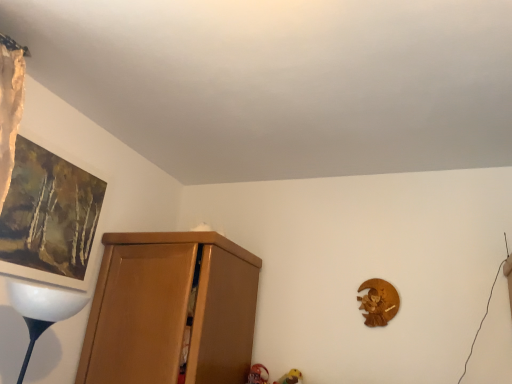
What is the approximate height of matte brown picture frame at upper left?

matte brown picture frame at upper left is 22.93 inches tall.

Describe the element at coordinates (49, 216) in the screenshot. Image resolution: width=512 pixels, height=384 pixels. I see `matte brown picture frame at upper left` at that location.

You are a GUI agent. You are given a task and a screenshot of the screen. Output one action in this format:
    pyautogui.click(x=<x>, y=<y>)
    Task: Click on the matte brown picture frame at upper left
    
    Given the screenshot: What is the action you would take?
    pyautogui.click(x=49, y=216)

This screenshot has height=384, width=512. Find the location of `matte wood cupboard at left`. matte wood cupboard at left is located at coordinates (170, 309).

The image size is (512, 384). What do you see at coordinates (170, 309) in the screenshot?
I see `matte wood cupboard at left` at bounding box center [170, 309].

What is the approximate height of matte wood cupboard at left?

It is 28.36 inches.

Where is `matte brown picture frame at upper left`? matte brown picture frame at upper left is located at coordinates (49, 216).

Based on their positions, is matte wood cupboard at left located to the left or right of matte brown picture frame at upper left?

matte wood cupboard at left is to the right of matte brown picture frame at upper left.

Between matte wood cupboard at left and matte brown picture frame at upper left, which one is positioned in front?

matte brown picture frame at upper left is in front.

Between point (228, 307) and point (29, 232), which one is positioned in front?

The point (29, 232) is closer.

From the image's perspective, which one is positioned lower, matte wood cupboard at left or matte brown picture frame at upper left?

matte wood cupboard at left appears lower in the image.

From a real-world perspective, is matte wood cupboard at left on matte brown picture frame at upper left?

No, from a real-world perspective, matte wood cupboard at left is not above matte brown picture frame at upper left.

Based on the photo, considering the sizes of matte wood cupboard at left and matte brown picture frame at upper left in the image, is matte wood cupboard at left wider or thinner than matte brown picture frame at upper left?

Considering their sizes, matte wood cupboard at left looks broader than matte brown picture frame at upper left.

Considering the sizes of objects matte wood cupboard at left and matte brown picture frame at upper left in the image provided, who is shorter, matte wood cupboard at left or matte brown picture frame at upper left?

Standing shorter between the two is matte brown picture frame at upper left.

Considering the sizes of objects matte wood cupboard at left and matte brown picture frame at upper left in the image provided, who is bigger, matte wood cupboard at left or matte brown picture frame at upper left?

matte wood cupboard at left is bigger.

Would you say matte wood cupboard at left is outside matte brown picture frame at upper left?

Indeed, matte wood cupboard at left is completely outside matte brown picture frame at upper left.

Consider the image. Is matte wood cupboard at left far away from matte brown picture frame at upper left?

No, matte wood cupboard at left is not far from matte brown picture frame at upper left.

Is matte wood cupboard at left turned away from matte brown picture frame at upper left?

That's not correct — matte wood cupboard at left is not looking away from matte brown picture frame at upper left.

What's the angular difference between matte wood cupboard at left and matte brown picture frame at upper left's facing directions?

They differ by 90 degrees in their facing directions.

The width and height of the screenshot is (512, 384). Find the location of `cupboard lying on the right of matte brown picture frame at upper left`. cupboard lying on the right of matte brown picture frame at upper left is located at coordinates (170, 309).

Does matte brown picture frame at upper left appear on the right side of matte wood cupboard at left?

No.

Who is more distant, matte brown picture frame at upper left or matte wood cupboard at left?

matte wood cupboard at left is further from the camera.

Is point (61, 231) more distant than point (133, 242)?

No, it is in front of (133, 242).

From the image's perspective, is matte brown picture frame at upper left under matte wood cupboard at left?

No, from the image's perspective, matte brown picture frame at upper left is not below matte wood cupboard at left.

From a real-world perspective, is matte brown picture frame at upper left positioned above or below matte wood cupboard at left?

matte brown picture frame at upper left is above matte wood cupboard at left.

Between matte brown picture frame at upper left and matte wood cupboard at left, which one has smaller width?

With smaller width is matte brown picture frame at upper left.

Based on the photo, considering the relative sizes of matte brown picture frame at upper left and matte wood cupboard at left in the image provided, is matte brown picture frame at upper left taller than matte wood cupboard at left?

No, matte brown picture frame at upper left is not taller than matte wood cupboard at left.

Looking at the image, does matte brown picture frame at upper left seem bigger or smaller compared to matte wood cupboard at left?

Considering their sizes, matte brown picture frame at upper left takes up less space than matte wood cupboard at left.

Could matte wood cupboard at left be considered to be inside matte brown picture frame at upper left?

That's incorrect, matte wood cupboard at left is not inside matte brown picture frame at upper left.

Is the surface of matte brown picture frame at upper left in direct contact with matte wood cupboard at left?

matte brown picture frame at upper left and matte wood cupboard at left are not in contact.

Is matte brown picture frame at upper left facing towards matte wood cupboard at left?

No.

What's the angular difference between matte brown picture frame at upper left and matte wood cupboard at left's facing directions?

There is a 90-degree angle between the facing directions of matte brown picture frame at upper left and matte wood cupboard at left.

This screenshot has width=512, height=384. What are the coordinates of `cupboard located behind the matte brown picture frame at upper left` in the screenshot? It's located at (170, 309).

The height and width of the screenshot is (384, 512). What are the coordinates of `cupboard lying behind the matte brown picture frame at upper left` in the screenshot? It's located at (170, 309).

Find the location of `picture frame above the matte wood cupboard at left (from a real-world perspective)`. picture frame above the matte wood cupboard at left (from a real-world perspective) is located at coordinates (49, 216).